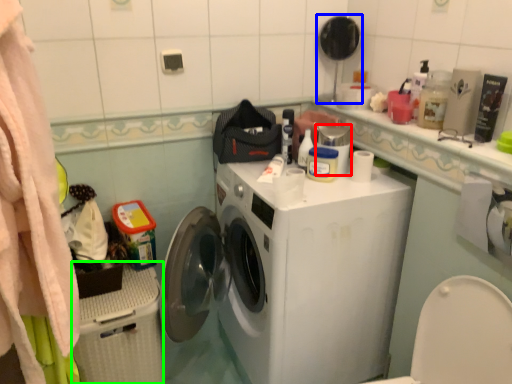
Question: Estimate the real-world distances between objects in this image. Which object is farther from appliance (highlighted by a red box), mirror (highlighted by a blue box) or dish washer (highlighted by a green box)?

Choices:
 (A) mirror
 (B) dish washer

Answer: (B)